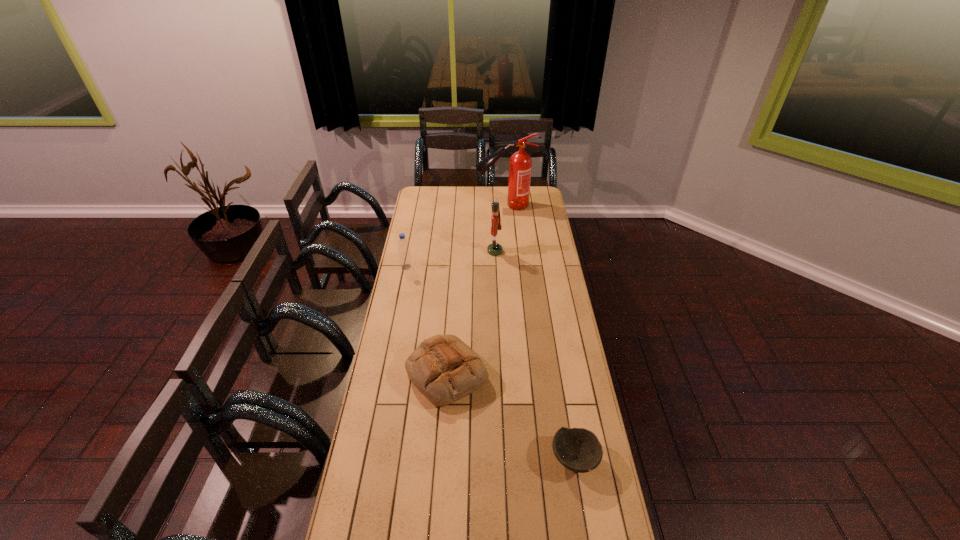
Locate an element on the screen. free space between the fourth farthest object and the nearest object is located at coordinates (511, 416).

Identify the location of free point between the third nearest object and the nutcracker. This screenshot has height=540, width=960. (450, 259).

Locate an element on the screen. This screenshot has height=540, width=960. free space between the bread and the nutcracker is located at coordinates (470, 313).

Find the location of a particular element. The width and height of the screenshot is (960, 540). vacant space in between the fire extinguisher and the shortest object is located at coordinates (540, 332).

The image size is (960, 540). Find the location of `object that is the fourth nearest to the tallest object`. object that is the fourth nearest to the tallest object is located at coordinates (579, 450).

You are a GUI agent. You are given a task and a screenshot of the screen. Output one action in this format:
    pyautogui.click(x=<x>, y=<y>)
    Task: Click on the fourth closest object to the farthest object
    
    Given the screenshot: What is the action you would take?
    pyautogui.click(x=579, y=450)

Where is `free location that satisfies the following two spatial constraints: 1. on the front-facing side of the second farthest object; 2. on the front side of the bottle`? free location that satisfies the following two spatial constraints: 1. on the front-facing side of the second farthest object; 2. on the front side of the bottle is located at coordinates pos(495,267).

Identify the location of free location that satisfies the following two spatial constraints: 1. at the nozzle end of the tallest object; 2. on the front side of the bread. Image resolution: width=960 pixels, height=540 pixels. (517, 374).

Find the location of a particular element. The width and height of the screenshot is (960, 540). free point that satisfies the following two spatial constraints: 1. at the nozzle end of the fire extinguisher; 2. on the left side of the nearest object is located at coordinates (524, 458).

I want to click on vacant space that satisfies the following two spatial constraints: 1. on the front-facing side of the second farthest object; 2. on the front side of the bottle, so click(495, 267).